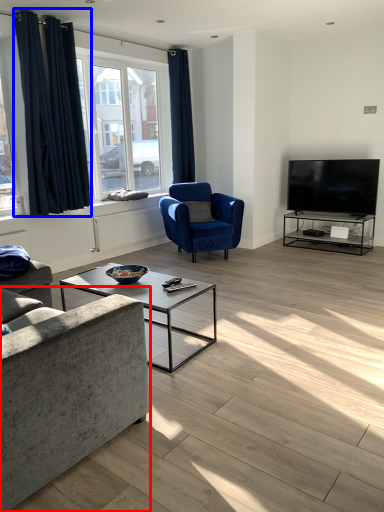
Question: Which object is closer to the camera taking this photo, studio couch (highlighted by a red box) or curtain (highlighted by a blue box)?

Choices:
 (A) studio couch
 (B) curtain

Answer: (A)